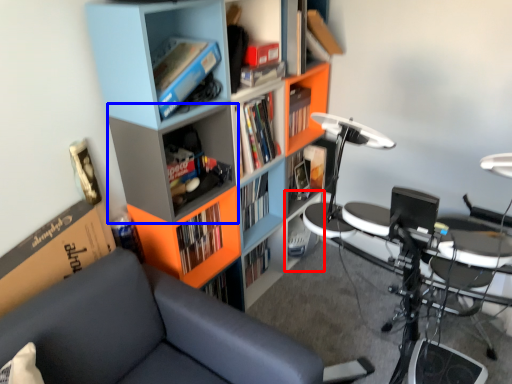
Question: Which object appears closest to the camera in this image, cabinet (highlighted by a red box) or shelf (highlighted by a blue box)?

Choices:
 (A) cabinet
 (B) shelf

Answer: (B)